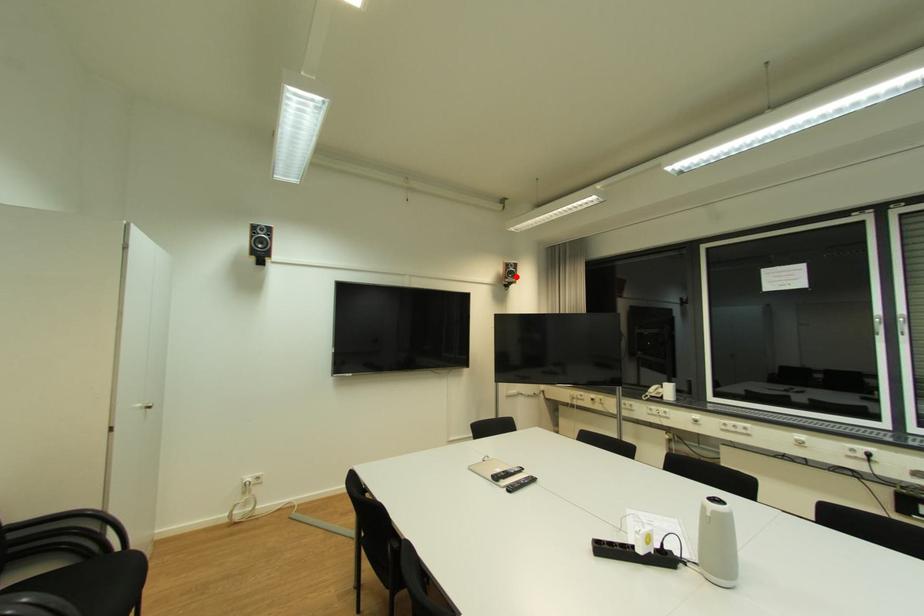
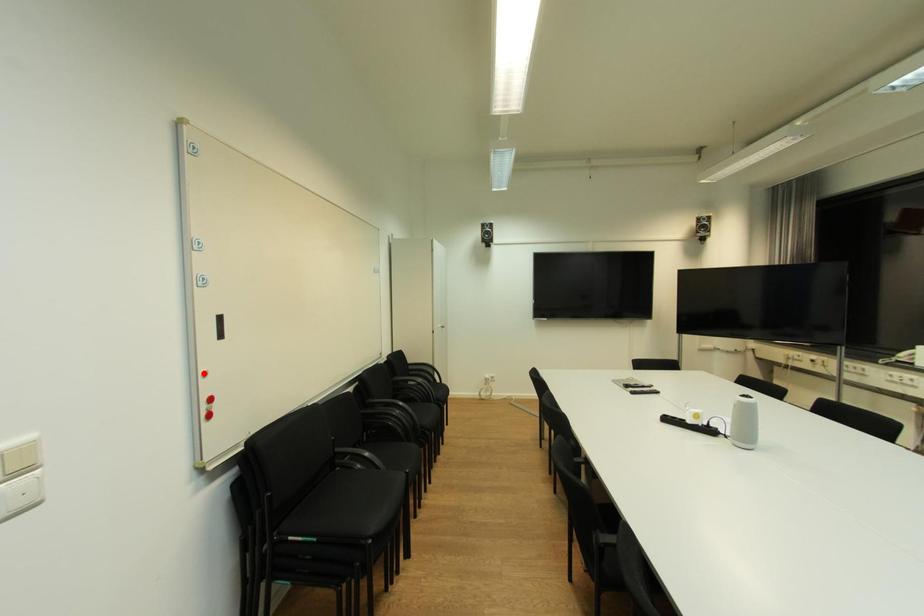
I am providing you with two images of the same scene from different viewpoints. A red point is marked on the first image and another point is marked on the second image. Is the red point in image1 aligned with the point shown in image2?

No